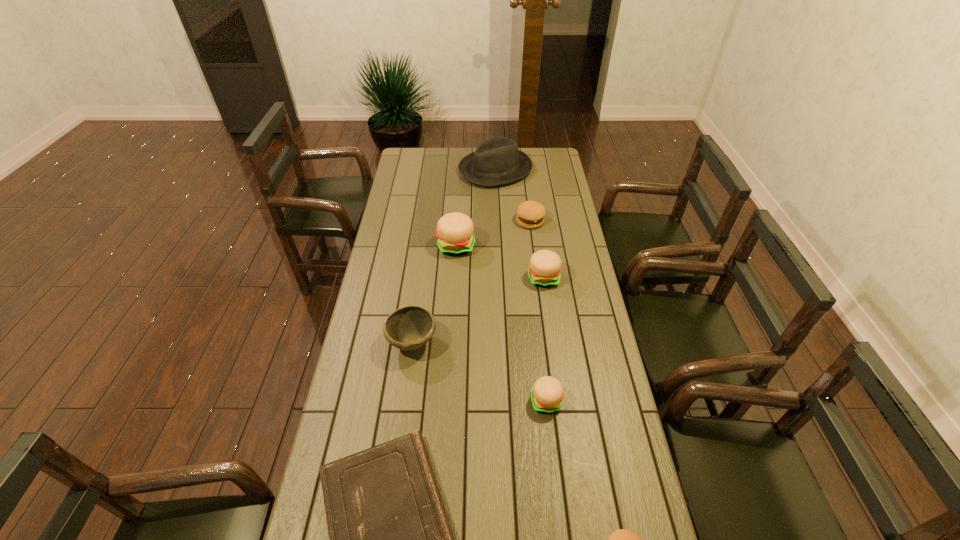
What are the coordinates of `the nearest beige hamburger` in the screenshot? It's located at pos(547,394).

Find the location of `vacant space located 0.080m on the right of the gray fedora`. vacant space located 0.080m on the right of the gray fedora is located at coordinates (547, 170).

The image size is (960, 540). In order to click on vacant area situated on the front of the leftmost beige hamburger in this screenshot , I will do `click(452, 313)`.

I want to click on free point located 0.050m on the right of the fifth nearest object, so click(x=572, y=278).

Locate an element on the screen. This screenshot has width=960, height=540. vacant space located on the front of the fourth nearest object is located at coordinates (406, 394).

Find the location of `vacant space located 0.190m on the left of the farthest hamburger`. vacant space located 0.190m on the left of the farthest hamburger is located at coordinates (474, 221).

Image resolution: width=960 pixels, height=540 pixels. What are the coordinates of `vacant space situated on the left of the nearest beige hamburger` in the screenshot? It's located at (440, 401).

The height and width of the screenshot is (540, 960). I want to click on object present at the far edge, so 496,161.

Find the location of a particular element. object positioned at the left edge is located at coordinates (408, 328).

The height and width of the screenshot is (540, 960). What are the coordinates of `fedora positioned at the right edge` in the screenshot? It's located at (496, 161).